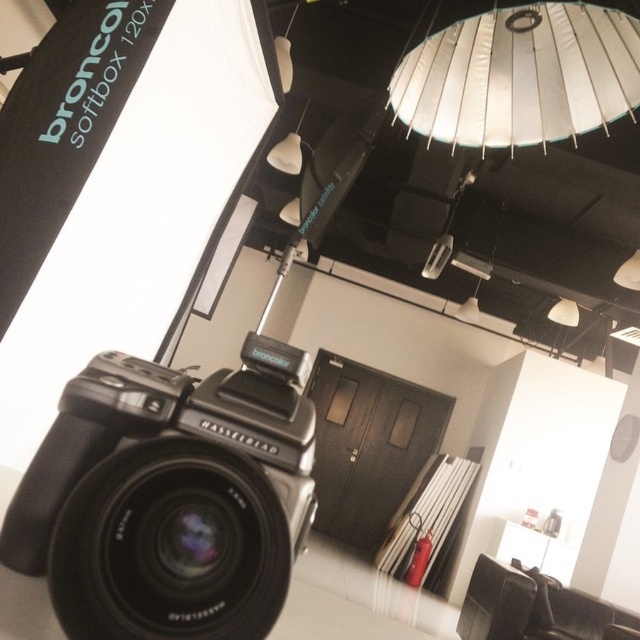
Question: Considering the real-world distances, which object is farthest from the white matte lampshade at upper center?

Choices:
 (A) white fabric lampshade at upper center
 (B) black matte hasselblad camera at center

Answer: (B)

Question: Is black matte hasselblad camera at center below white matte lampshade at upper center?

Choices:
 (A) no
 (B) yes

Answer: (B)

Question: Which of these objects is positioned closest to the black matte hasselblad camera at center?

Choices:
 (A) white fabric lampshade at upper center
 (B) white matte lampshade at upper center

Answer: (A)

Question: Does black matte hasselblad camera at center come in front of white fabric lampshade at upper center?

Choices:
 (A) yes
 (B) no

Answer: (A)

Question: Can you confirm if black matte hasselblad camera at center is positioned below white matte lampshade at upper center?

Choices:
 (A) yes
 (B) no

Answer: (A)

Question: Among these objects, which one is nearest to the camera?

Choices:
 (A) black matte hasselblad camera at center
 (B) white matte lampshade at upper center
 (C) white fabric lampshade at upper center

Answer: (A)